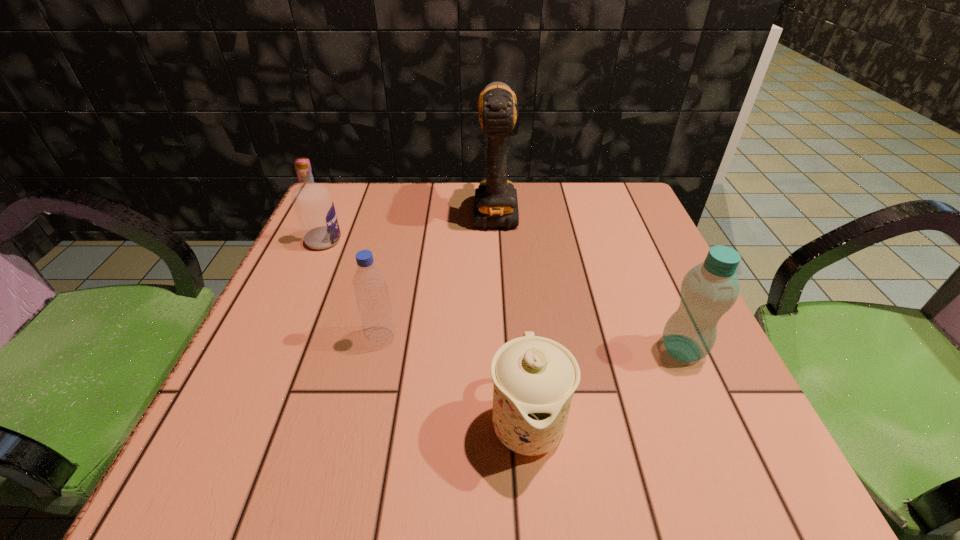
Point out which object is positioned as the second nearest to the rightmost object. Please provide its 2D coordinates. Your answer should be formatted as a tuple, i.e. [(x, y)], where the tuple contains the x and y coordinates of a point satisfying the conditions above.

[(496, 205)]

This screenshot has width=960, height=540. In order to click on free space that satisfies the following two spatial constraints: 1. on the label of the rightmost object; 2. on the right side of the leftmost object in this screenshot , I will do `click(275, 349)`.

Find the location of a particular element. Image resolution: width=960 pixels, height=540 pixels. blank area in the image that satisfies the following two spatial constraints: 1. on the label of the fourth object from right to left; 2. on the right side of the leftmost object is located at coordinates (280, 338).

This screenshot has height=540, width=960. Identify the location of blank area in the image that satisfies the following two spatial constraints: 1. on the back side of the rightmost object; 2. on the label of the vodka. (635, 241).